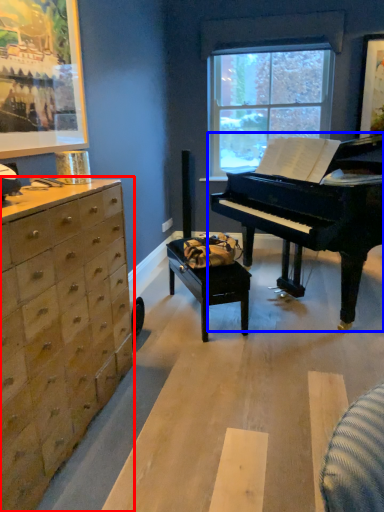
Question: Which object is further to the camera taking this photo, chest of drawers (highlighted by a red box) or piano (highlighted by a blue box)?

Choices:
 (A) chest of drawers
 (B) piano

Answer: (B)